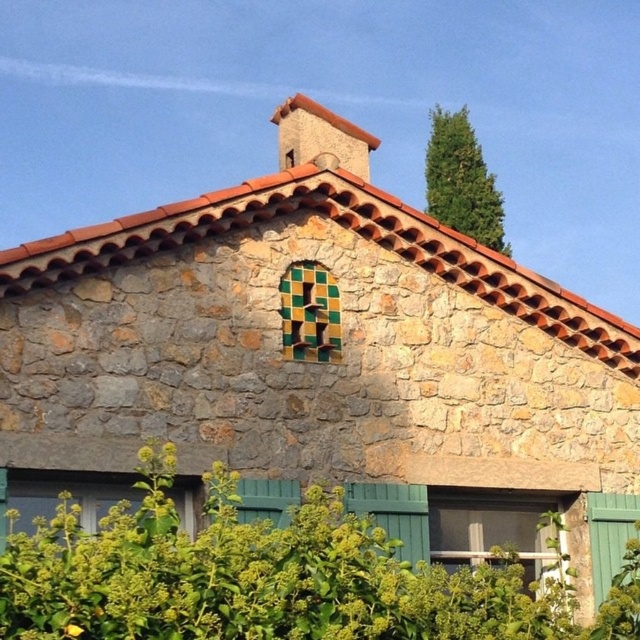
You are standing at the base of the rustic stone house and notice two points marked on the facade. The first point is located at coordinates point (502, 502), and the second is at point (52, 509). Which point is closer to the ground level?

Point (52, 509) is closer to the ground level because it is positioned lower on the facade than point (502, 502).

Where is the brown clay tile roof at upper center located in the image?

The brown clay tile roof at upper center is located at point (342, 227) in the image.